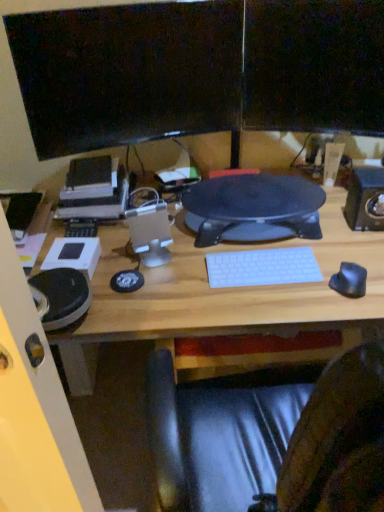
At what (x,y) coordinates should I click in order to perform the action: click on vacant area in front of black plastic speaker at right, marked as the 2th speaker in a left-to-right arrangement. Please return your answer as a coordinate pair (x, y). The image size is (384, 512). Looking at the image, I should click on (361, 250).